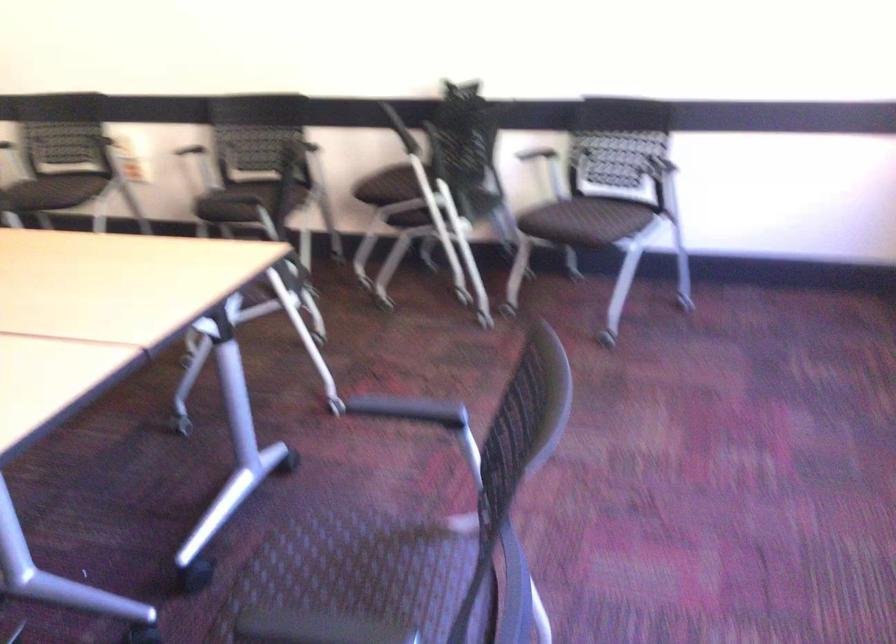
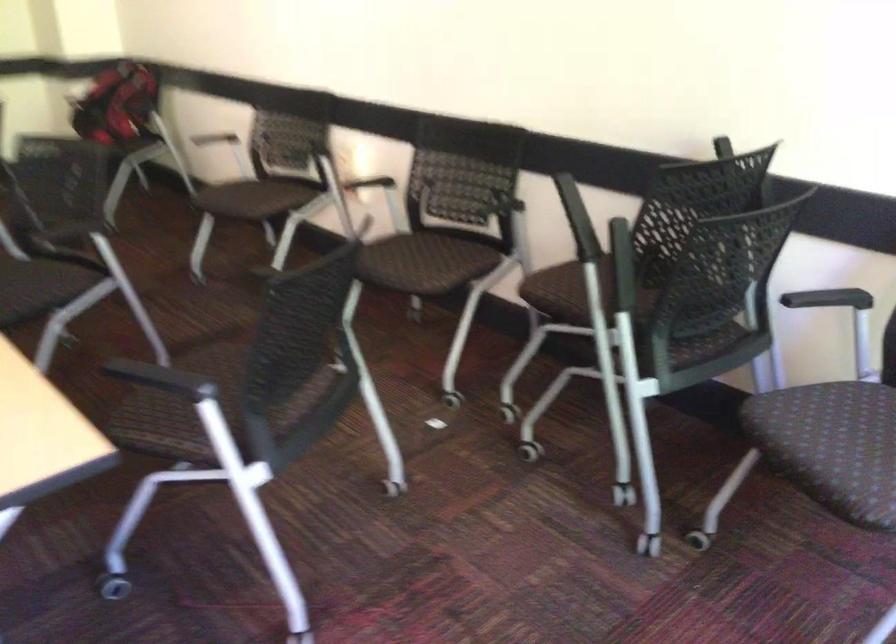
Question: In a continuous first-person perspective shot, in which direction is the camera moving?

Choices:
 (A) Left
 (B) Right
 (C) Forward
 (D) Backward

Answer: (C)